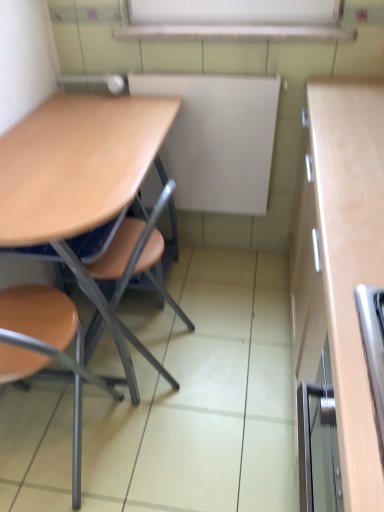
Question: Is matte wood desk at left inside the boundaries of white matte board at center, or outside?

Choices:
 (A) inside
 (B) outside

Answer: (B)

Question: From their relative heights in the image, would you say matte wood desk at left is taller or shorter than white matte board at center?

Choices:
 (A) short
 (B) tall

Answer: (B)

Question: Which is nearer to the matte wood desk at left?

Choices:
 (A) brown matte chair at left
 (B) white matte board at center

Answer: (A)

Question: Which object is the farthest from the matte wood desk at left?

Choices:
 (A) white matte board at center
 (B) brown matte chair at left

Answer: (A)